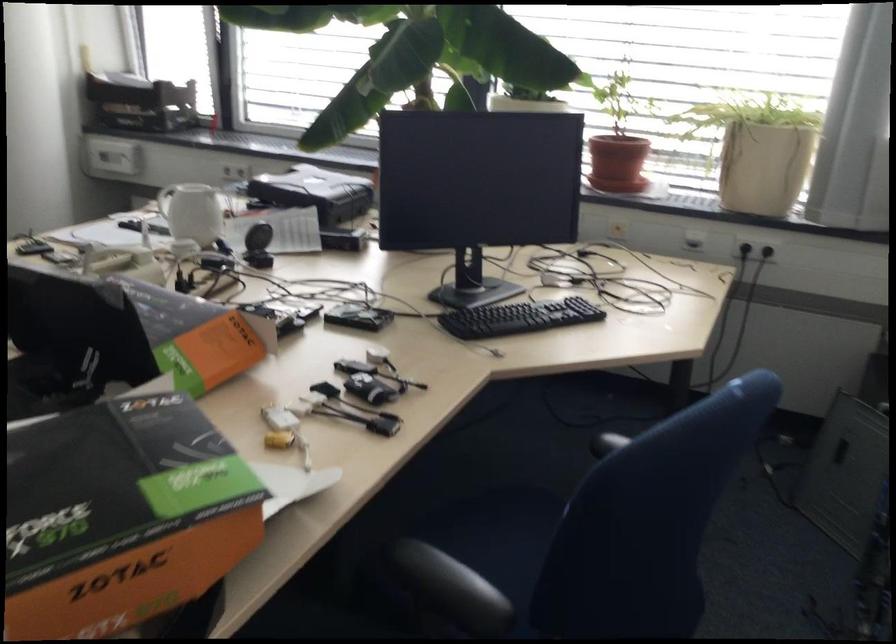
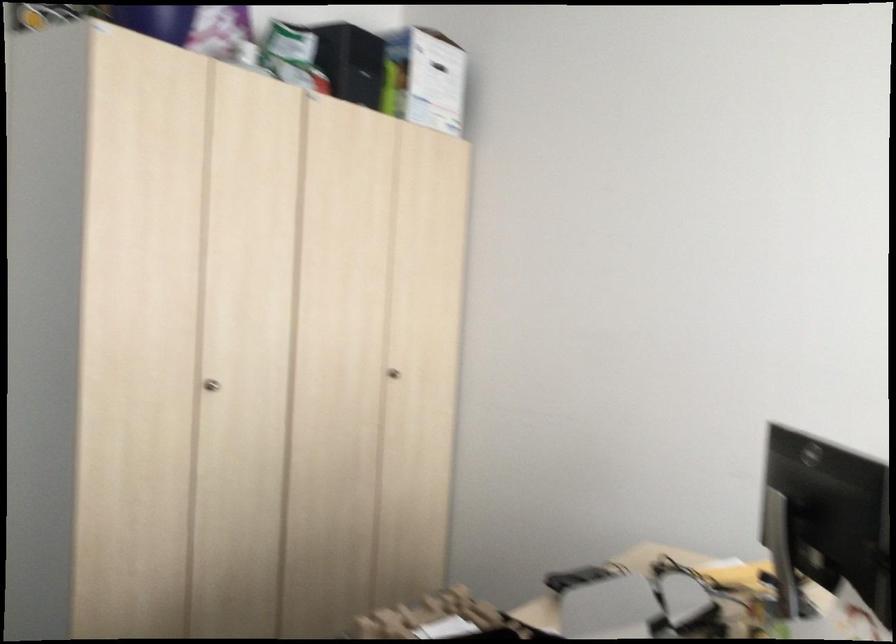
Question: The camera is either moving clockwise (left) or counter-clockwise (right) around the object. The first image is from the beginning of the video and the second image is from the end. Is the camera moving left or right when shooting the video?

Choices:
 (A) Left
 (B) Right

Answer: (B)